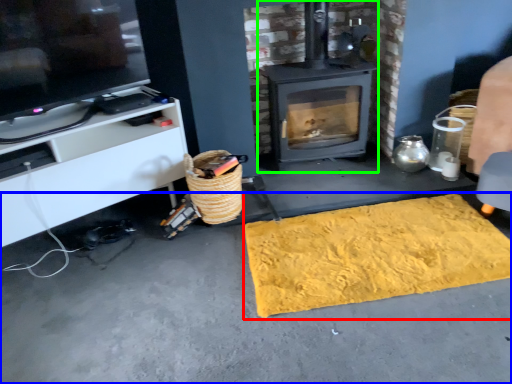
Question: Considering the real-world distances, which object is farthest from mat (highlighted by a red box)? concrete (highlighted by a blue box) or wood burning stove (highlighted by a green box)?

Choices:
 (A) concrete
 (B) wood burning stove

Answer: (B)